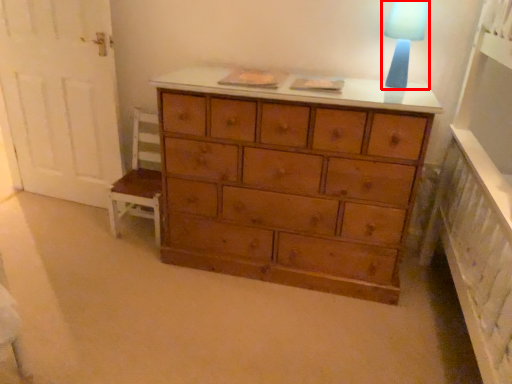
Question: From the image's perspective, what is the correct spatial positioning of lamp (annotated by the red box) in reference to armchair?

Choices:
 (A) below
 (B) above

Answer: (B)